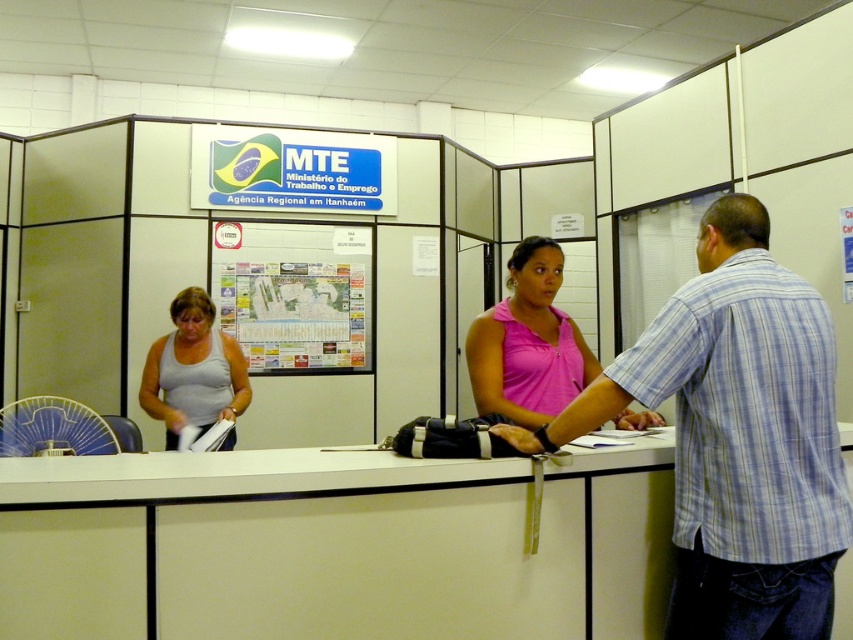
Does point (660, 577) lie in front of point (515, 337)?

Yes, it is.

Does white matte desk at center have a smaller size compared to pink matte tank top at center?

No, white matte desk at center is not smaller than pink matte tank top at center.

Between point (482, 525) and point (534, 380), which one is positioned behind?

The point (534, 380) is more distant.

You are a GUI agent. You are given a task and a screenshot of the screen. Output one action in this format:
    pyautogui.click(x=<x>, y=<y>)
    Task: Click on the white matte desk at center
    
    Given the screenshot: What is the action you would take?
    pyautogui.click(x=334, y=545)

Does pink matte tank top at center appear on the left side of clear plastic fan at left?

No, pink matte tank top at center is not to the left of clear plastic fan at left.

Is pink matte tank top at center below clear plastic fan at left?

No.

Is point (531, 291) closer to camera compared to point (35, 445)?

Yes, it is.

This screenshot has width=853, height=640. Identify the location of pink matte tank top at center. (527, 342).

Can you confirm if white matte desk at center is wider than gray matte tank top at center?

Yes.

Measure the distance between white matte desk at center and camera.

A distance of 4.52 feet exists between white matte desk at center and camera.

In order to click on white matte desk at center in this screenshot , I will do `click(334, 545)`.